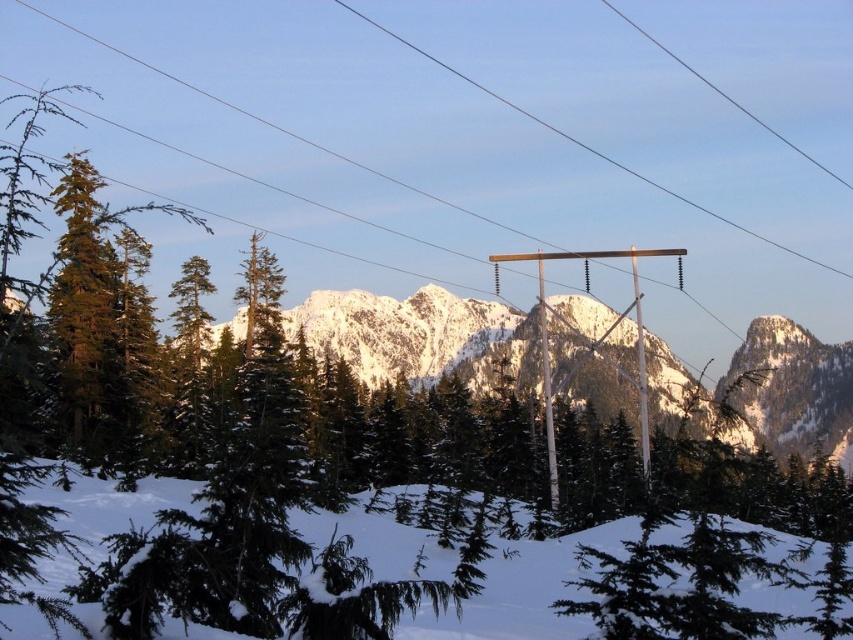
Question: Which point appears farthest from the camera in this image?

Choices:
 (A) (381, 29)
 (B) (827, 369)

Answer: (A)

Question: Based on their relative distances, which object is farther from the snowy pine trees at lower center?

Choices:
 (A) wooden pole at center
 (B) snowy granite mountain range at center

Answer: (A)

Question: Can you confirm if snowy pine trees at lower center is positioned to the right of wooden pole at center?

Choices:
 (A) no
 (B) yes

Answer: (A)

Question: Can you confirm if snowy granite mountain range at center is positioned above snowy pine trees at lower center?

Choices:
 (A) no
 (B) yes

Answer: (B)

Question: Which object appears farthest from the camera in this image?

Choices:
 (A) snowy granite mountain range at center
 (B) snowy pine trees at lower center
 (C) wooden pole at center

Answer: (C)

Question: Can you confirm if snowy granite mountain range at center is positioned to the left of snowy pine trees at lower center?

Choices:
 (A) yes
 (B) no

Answer: (B)